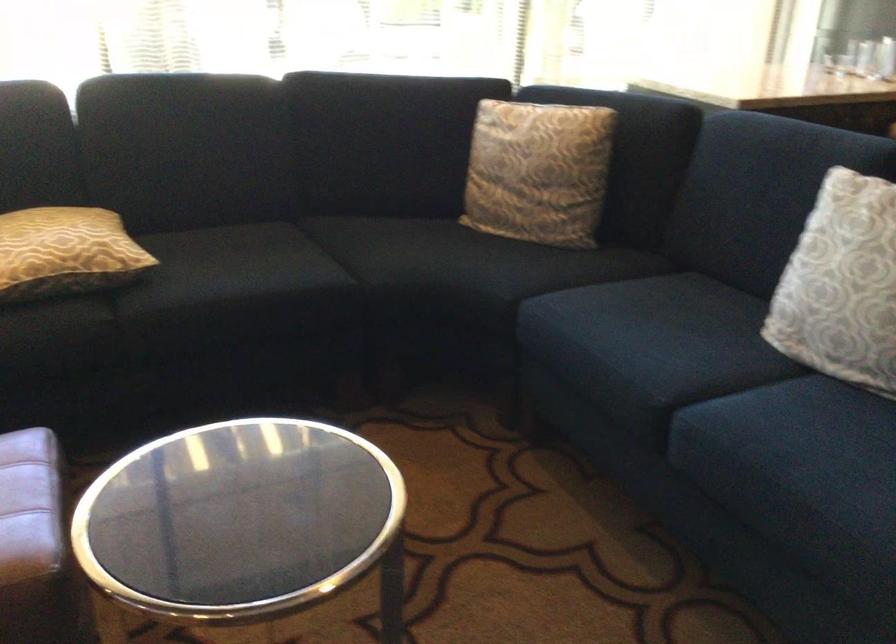
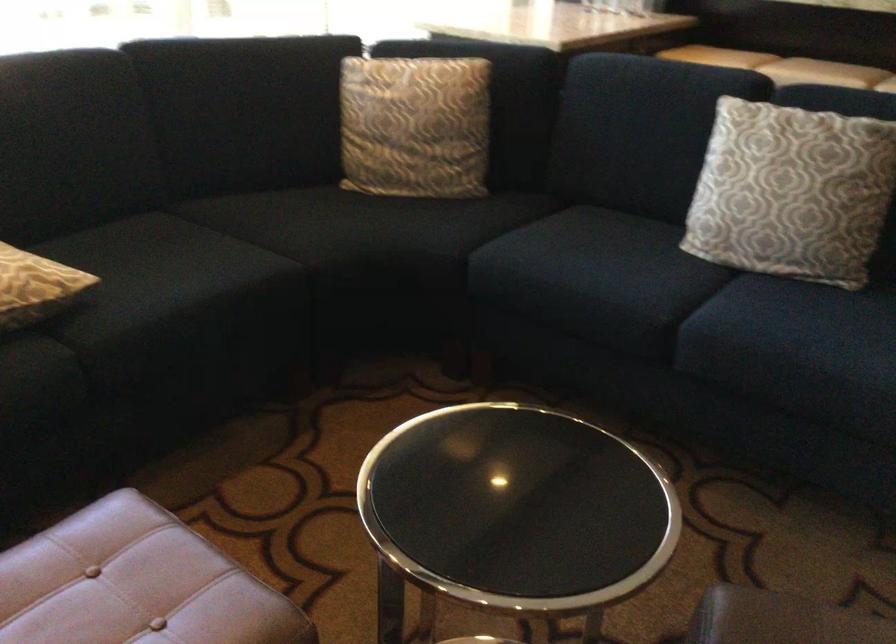
Find the pixel in the second image that matches [428,257] in the first image.

(348, 227)